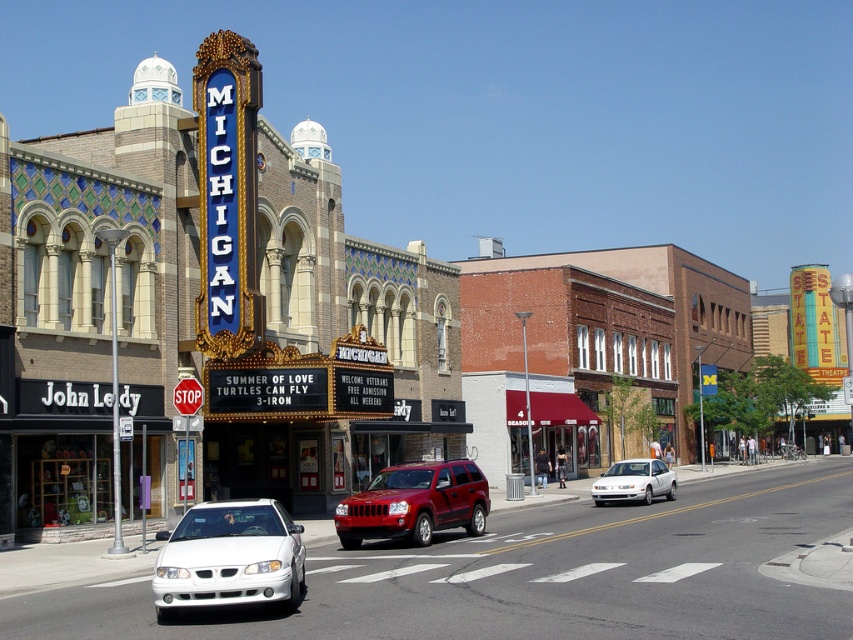
Is shiny red suv at center wider than white matte sedan at center?

No, shiny red suv at center is not wider than white matte sedan at center.

Where is `shiny red suv at center`? This screenshot has height=640, width=853. shiny red suv at center is located at coordinates (415, 502).

Does white glossy sedan at lower left have a greater width compared to shiny red suv at center?

Indeed, white glossy sedan at lower left has a greater width compared to shiny red suv at center.

Which of these two, white glossy sedan at lower left or shiny red suv at center, stands shorter?

shiny red suv at center is shorter.

Find the location of `white glossy sedan at lower left`. white glossy sedan at lower left is located at coordinates (229, 557).

Is white glossy sedan at lower left shorter than white matte sedan at center?

Yes.

Is the position of white glossy sedan at lower left less distant than that of white matte sedan at center?

That is True.

This screenshot has width=853, height=640. Identify the location of white glossy sedan at lower left. (229, 557).